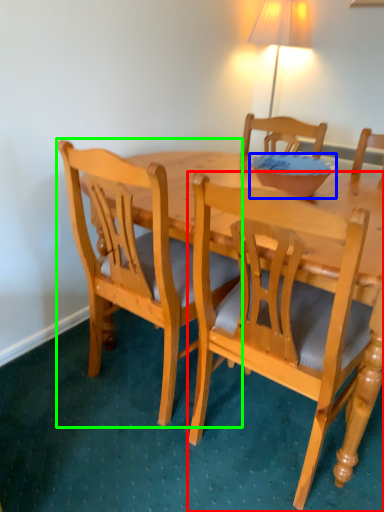
Question: Considering the real-world distances, which object is closest to chair (highlighted by a red box)? bowl (highlighted by a blue box) or chair (highlighted by a green box).

Choices:
 (A) bowl
 (B) chair

Answer: (B)